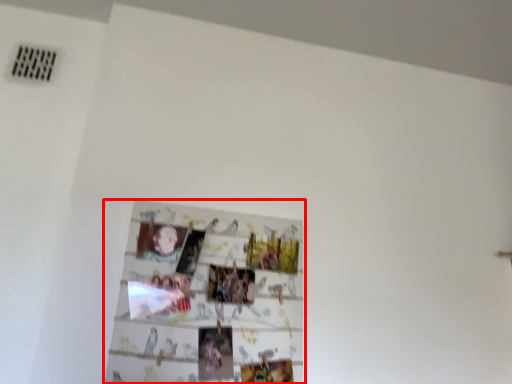
Question: Considering the relative positions of picture frame (annotated by the red box) and person in the image provided, where is picture frame (annotated by the red box) located with respect to the staircase?

Choices:
 (A) left
 (B) right

Answer: (B)